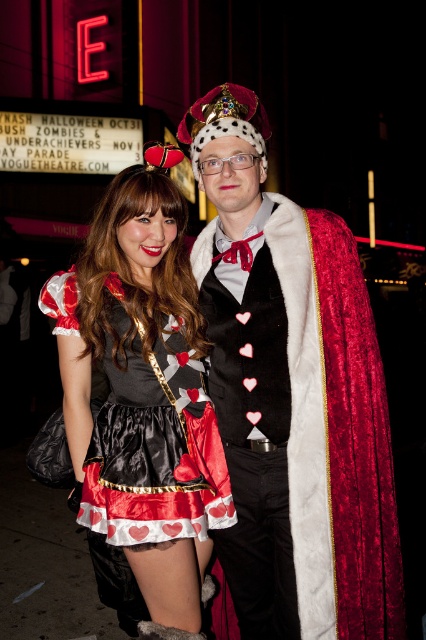
Question: Does velvet heart-patterned dress at center appear under satin dress at center?

Choices:
 (A) yes
 (B) no

Answer: (B)

Question: Which point is farther to the camera?

Choices:
 (A) (299, 300)
 (B) (359, 500)

Answer: (A)

Question: Estimate the real-world distances between objects in this image. Which object is farther from the velvet red cape at center?

Choices:
 (A) satin dress at center
 (B) velvet heart-patterned dress at center

Answer: (A)

Question: Is velvet heart-patterned dress at center above velvet red cape at center?

Choices:
 (A) yes
 (B) no

Answer: (A)

Question: Is velvet heart-patterned dress at center bigger than velvet red cape at center?

Choices:
 (A) yes
 (B) no

Answer: (A)

Question: Which is nearer to the velvet heart-patterned dress at center?

Choices:
 (A) satin dress at center
 (B) velvet red cape at center

Answer: (B)